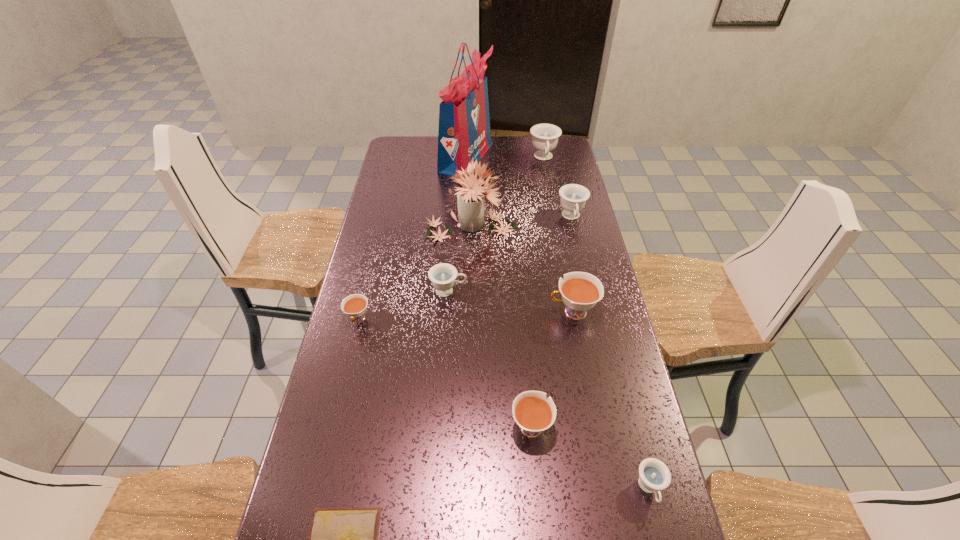
Locate an element on the screen. The image size is (960, 540). teacup located in the far edge section of the desktop is located at coordinates (544, 136).

In order to click on object located in the left edge section of the desktop in this screenshot , I will do `click(355, 305)`.

Locate an element on the screen. The image size is (960, 540). object situated at the far right corner is located at coordinates (544, 136).

The height and width of the screenshot is (540, 960). Identify the location of free space at the far edge of the desktop. (484, 154).

Locate an element on the screen. free space at the left edge of the desktop is located at coordinates (419, 176).

The width and height of the screenshot is (960, 540). In the image, there is a desktop. Identify the location of vacant space at the right edge. (613, 325).

You are a GUI agent. You are given a task and a screenshot of the screen. Output one action in this format:
    pyautogui.click(x=<x>, y=<y>)
    Task: Click on the empty space that is in between the biggest white teacup and the second tallest object
    The height and width of the screenshot is (540, 960).
    Given the screenshot: What is the action you would take?
    pyautogui.click(x=521, y=269)

At what (x,y) coordinates should I click in order to perform the action: click on empty space between the nearest blue teacup and the white bouquet. Please return your answer as a coordinate pair (x, y). Image resolution: width=960 pixels, height=540 pixels. Looking at the image, I should click on (560, 357).

Identify the location of free spot between the leftmost blue teacup and the second nearest teacup. The image size is (960, 540). (490, 358).

This screenshot has width=960, height=540. Find the location of `free space between the smallest white teacup and the third teacup from left to right`. free space between the smallest white teacup and the third teacup from left to right is located at coordinates (444, 372).